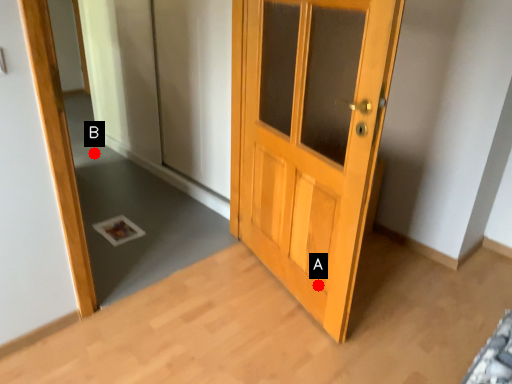
Question: Two points are circled on the image, labeled by A and B beside each circle. Which point appears closest to the camera in this image?

Choices:
 (A) A is closer
 (B) B is closer

Answer: (A)